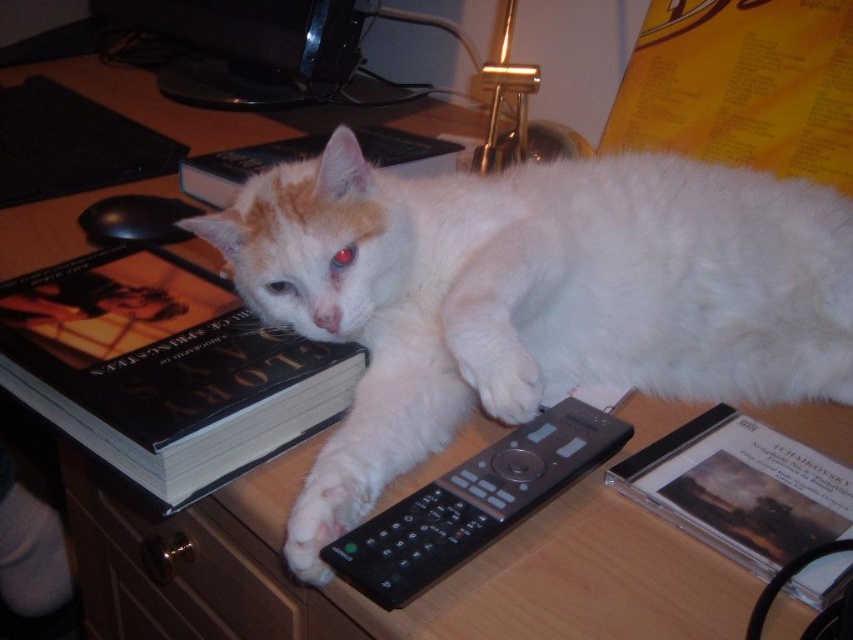
Question: Which point appears farthest from the camera in this image?

Choices:
 (A) (705, 477)
 (B) (296, 500)
 (C) (573, 481)

Answer: (A)

Question: From the image, what is the correct spatial relationship of white fluffy cat at center in relation to black hardcover book at upper left?

Choices:
 (A) left
 (B) right

Answer: (B)

Question: Which point is closer to the camera taking this photo?

Choices:
 (A) (744, 262)
 (B) (299, 573)
 (C) (311, 140)
 (D) (520, 480)

Answer: (B)

Question: Which of these objects is positioned closest to the black hardcover book at upper left?

Choices:
 (A) white fluffy cat at center
 (B) matte plastic cd case at lower right
 (C) white fur paw at center
 (D) hardcover book at upper left

Answer: (A)

Question: Can you confirm if white fluffy cat at center is positioned to the right of white fur paw at center?

Choices:
 (A) yes
 (B) no

Answer: (A)

Question: Can you confirm if white fluffy cat at center is smaller than white fur paw at center?

Choices:
 (A) no
 (B) yes

Answer: (A)